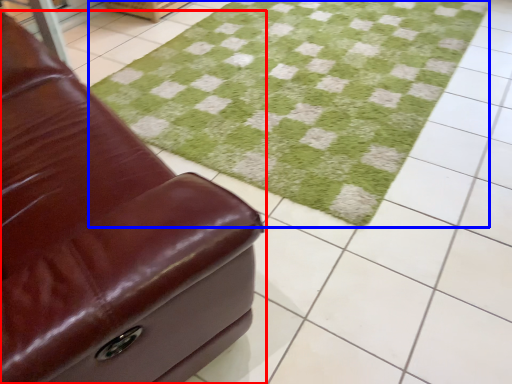
Question: Which object appears farthest to the camera in this image, furniture (highlighted by a red box) or grass (highlighted by a blue box)?

Choices:
 (A) furniture
 (B) grass

Answer: (B)